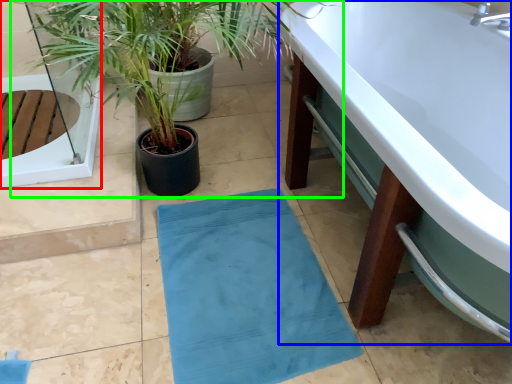
Question: Which object is positioned closest to glass door (highlighted by a red box)? Select from bathtub (highlighted by a blue box) and houseplant (highlighted by a green box).

Choices:
 (A) bathtub
 (B) houseplant

Answer: (B)